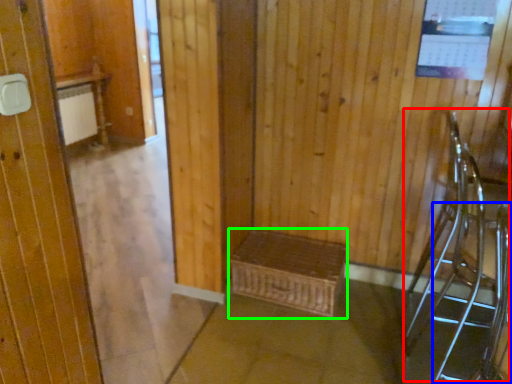
Question: Estimate the real-world distances between objects in this image. Which object is closer to armchair (highlighted by a red box), armchair (highlighted by a blue box) or furniture (highlighted by a green box)?

Choices:
 (A) armchair
 (B) furniture

Answer: (A)